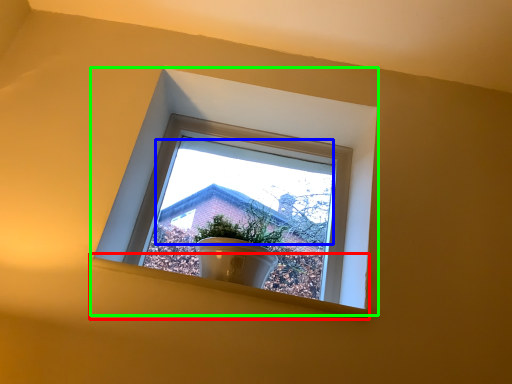
Question: Considering the real-world distances, which object is closest to window sill (highlighted by a red box)? morning light (highlighted by a blue box) or window (highlighted by a green box).

Choices:
 (A) morning light
 (B) window

Answer: (B)